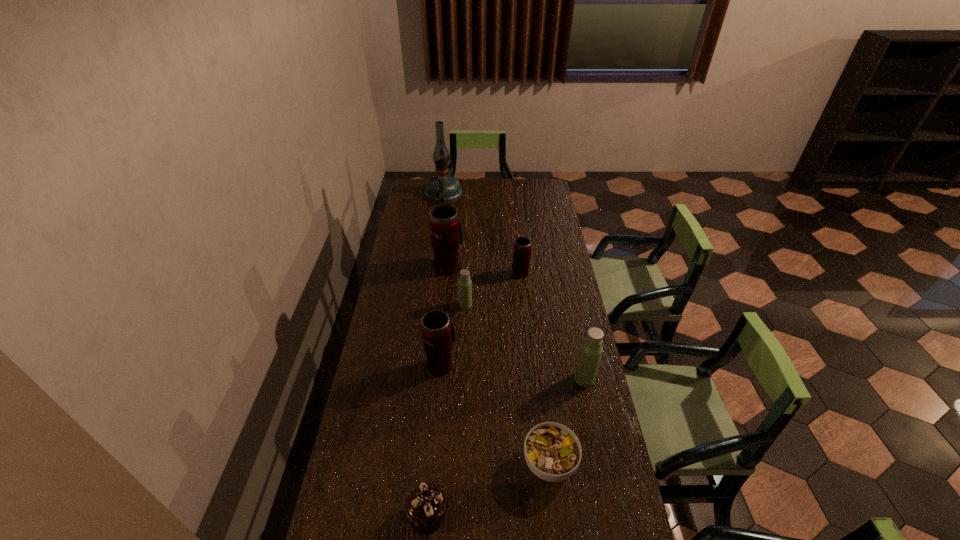
The image size is (960, 540). What are the coordinates of `the tallest object` in the screenshot? It's located at (442, 188).

Identify the location of oil lamp. (442, 188).

Where is `the tallest thermos bottle`? The width and height of the screenshot is (960, 540). the tallest thermos bottle is located at coordinates (446, 232).

Identify the location of the biggest red thermos bottle. [x=446, y=232].

The width and height of the screenshot is (960, 540). Identify the location of the second biggest red thermos bottle. (438, 332).

At what (x,y) coordinates should I click in order to perform the action: click on the bigger light thermos bottle. Please return your answer as a coordinate pair (x, y). This screenshot has width=960, height=540. Looking at the image, I should click on (591, 349).

This screenshot has width=960, height=540. In order to click on the rightmost thermos bottle in this screenshot , I will do `click(591, 349)`.

Identify the location of the rightmost red thermos bottle. (522, 248).

Find the location of `the second thermos bottle from right to left`. the second thermos bottle from right to left is located at coordinates (522, 248).

At what (x,y) coordinates should I click in order to perform the action: click on the smaller light thermos bottle. Please return your answer as a coordinate pair (x, y). The height and width of the screenshot is (540, 960). Looking at the image, I should click on (465, 284).